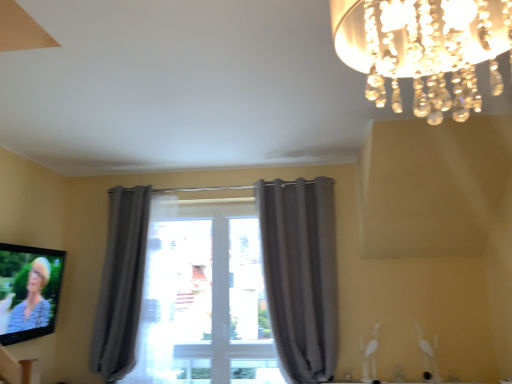
Question: Does matte black tv at lower left have a smaller size compared to gray fabric curtain at center, the first curtain viewed from the right?

Choices:
 (A) yes
 (B) no

Answer: (A)

Question: Does matte black tv at lower left come in front of gray fabric curtain at center, the first curtain viewed from the right?

Choices:
 (A) yes
 (B) no

Answer: (A)

Question: Is matte black tv at lower left outside gray fabric curtain at center, the first curtain viewed from the right?

Choices:
 (A) yes
 (B) no

Answer: (A)

Question: Considering the relative sizes of matte black tv at lower left and gray fabric curtain at center, the first curtain viewed from the right, in the image provided, is matte black tv at lower left bigger than gray fabric curtain at center, the first curtain viewed from the right,?

Choices:
 (A) no
 (B) yes

Answer: (A)

Question: Is matte black tv at lower left to the right of gray fabric curtain at center, which is the 2th curtain in left-to-right order, from the viewer's perspective?

Choices:
 (A) yes
 (B) no

Answer: (B)

Question: Relative to clear crystal chandelier at upper right, is gray fabric curtain at center, the first curtain viewed from the right, in front or behind?

Choices:
 (A) front
 (B) behind

Answer: (B)

Question: Is point (256, 198) positioned closer to the camera than point (435, 31)?

Choices:
 (A) farther
 (B) closer

Answer: (A)

Question: From the image's perspective, is gray fabric curtain at center, which is the 2th curtain in left-to-right order, positioned above or below clear crystal chandelier at upper right?

Choices:
 (A) above
 (B) below

Answer: (B)

Question: In terms of width, does gray fabric curtain at center, which is the 2th curtain in left-to-right order, look wider or thinner when compared to clear crystal chandelier at upper right?

Choices:
 (A) wide
 (B) thin

Answer: (B)

Question: From the image's perspective, relative to clear crystal chandelier at upper right, is gray fabric curtain at left, positioned as the 1th curtain in left-to-right order, above or below?

Choices:
 (A) below
 (B) above

Answer: (A)

Question: Is point (97, 370) positioned closer to the camera than point (457, 51)?

Choices:
 (A) farther
 (B) closer

Answer: (A)

Question: From a real-world perspective, is gray fabric curtain at left, positioned as the 1th curtain in left-to-right order, physically located above or below clear crystal chandelier at upper right?

Choices:
 (A) above
 (B) below

Answer: (B)

Question: In the image, is gray fabric curtain at left, the second curtain viewed from the right, on the left side or the right side of clear crystal chandelier at upper right?

Choices:
 (A) left
 (B) right

Answer: (A)

Question: Looking at the image, does matte black tv at lower left seem bigger or smaller compared to gray fabric curtain at center, the first curtain viewed from the right?

Choices:
 (A) small
 (B) big

Answer: (A)

Question: Is matte black tv at lower left inside or outside of gray fabric curtain at center, the first curtain viewed from the right?

Choices:
 (A) inside
 (B) outside

Answer: (B)